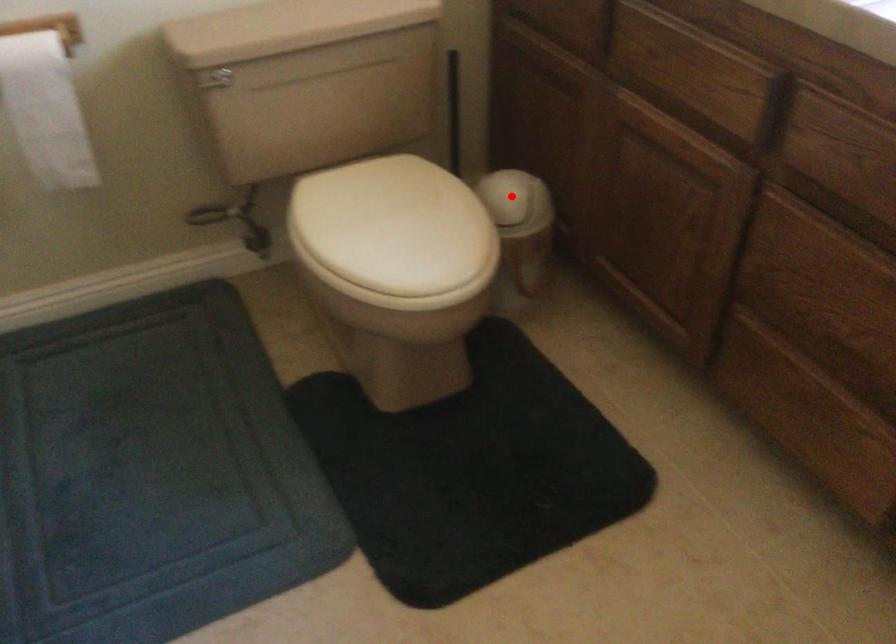
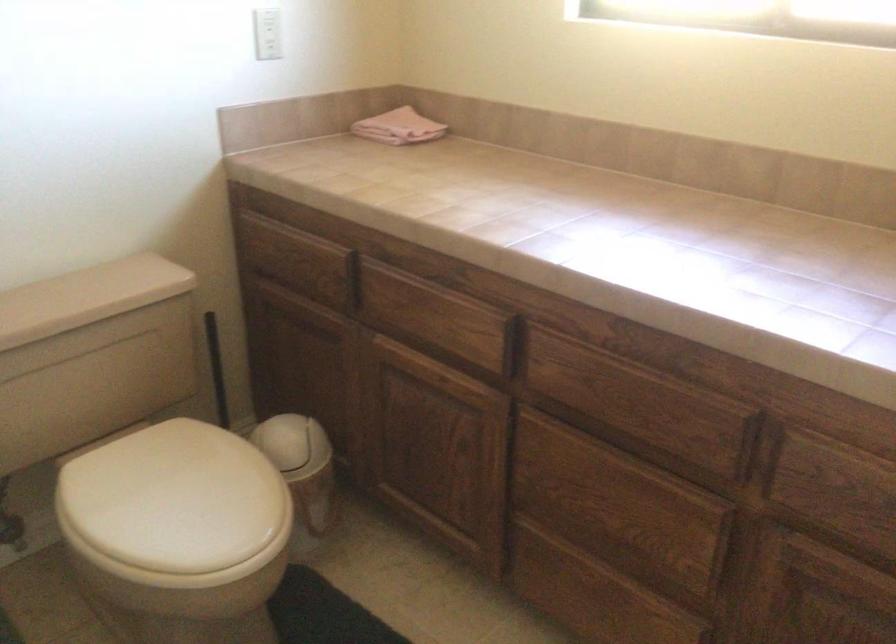
The point at the highlighted location is marked in the first image. Where is the corresponding point in the second image?

(293, 444)